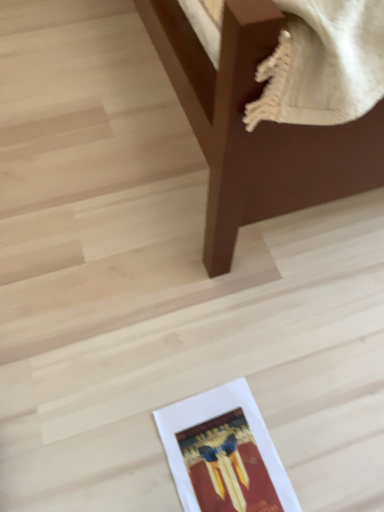
The image size is (384, 512). Describe the element at coordinates (224, 453) in the screenshot. I see `matte paper paperback book at lower center` at that location.

You are a GUI agent. You are given a task and a screenshot of the screen. Output one action in this format:
    pyautogui.click(x=<x>, y=<y>)
    Task: Click on the matte paper paperback book at lower center
    This screenshot has height=512, width=384.
    Given the screenshot: What is the action you would take?
    pyautogui.click(x=224, y=453)

I want to click on matte paper paperback book at lower center, so click(224, 453).